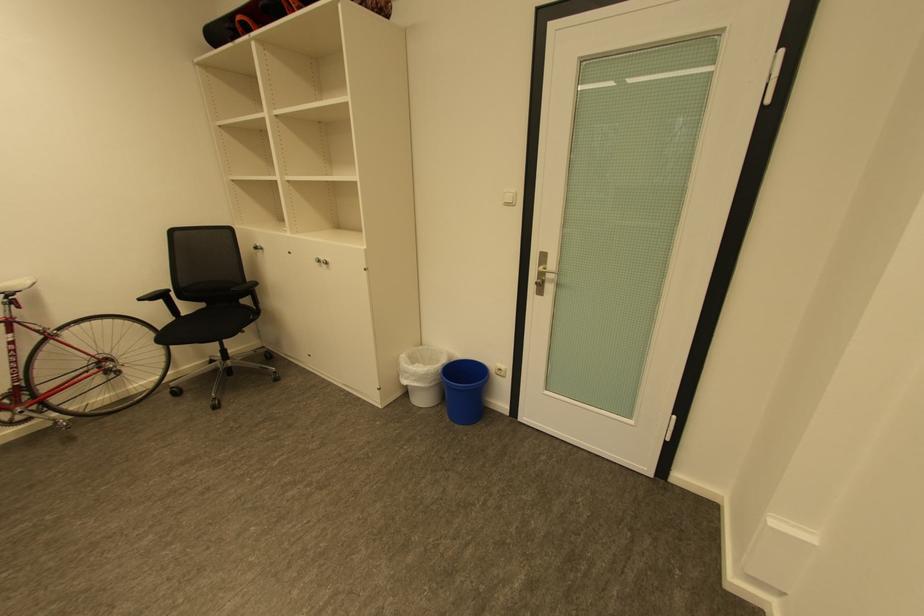
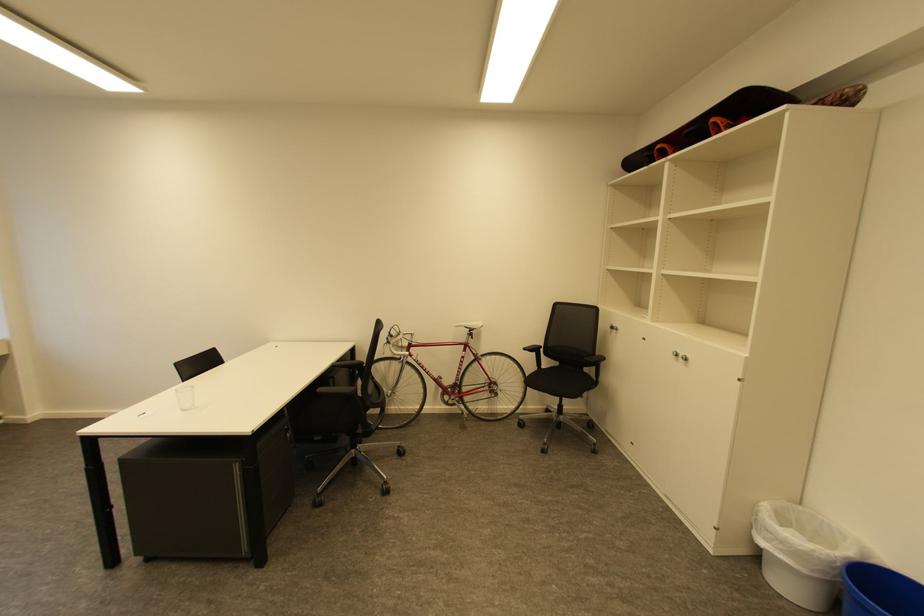
Find the pixel in the second image that matches the point at 190,315 in the first image.

(551, 368)